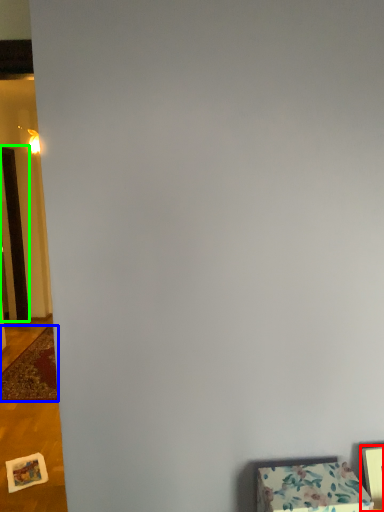
Question: Estimate the real-world distances between objects in this image. Which object is closer to picture frame (highlighted by a red box), mat (highlighted by a blue box) or door (highlighted by a green box)?

Choices:
 (A) mat
 (B) door

Answer: (A)